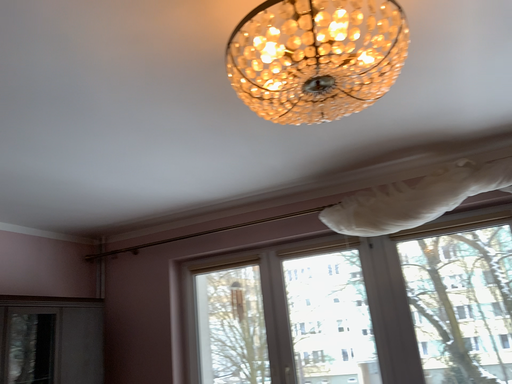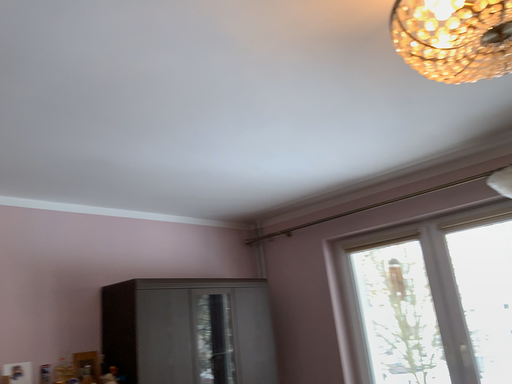
Question: Which way did the camera rotate in the video?

Choices:
 (A) rotated left
 (B) rotated right

Answer: (A)